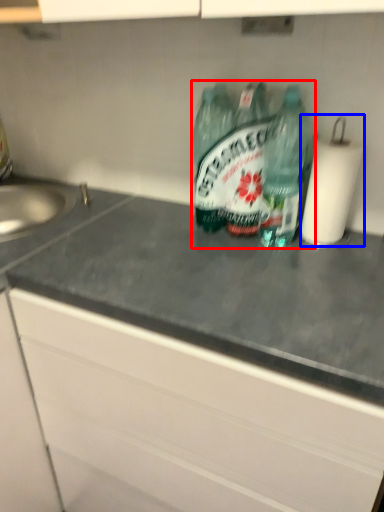
Question: Which of the following is the closest to the observer, bottle (highlighted by a red box) or paper towel (highlighted by a blue box)?

Choices:
 (A) bottle
 (B) paper towel

Answer: (B)